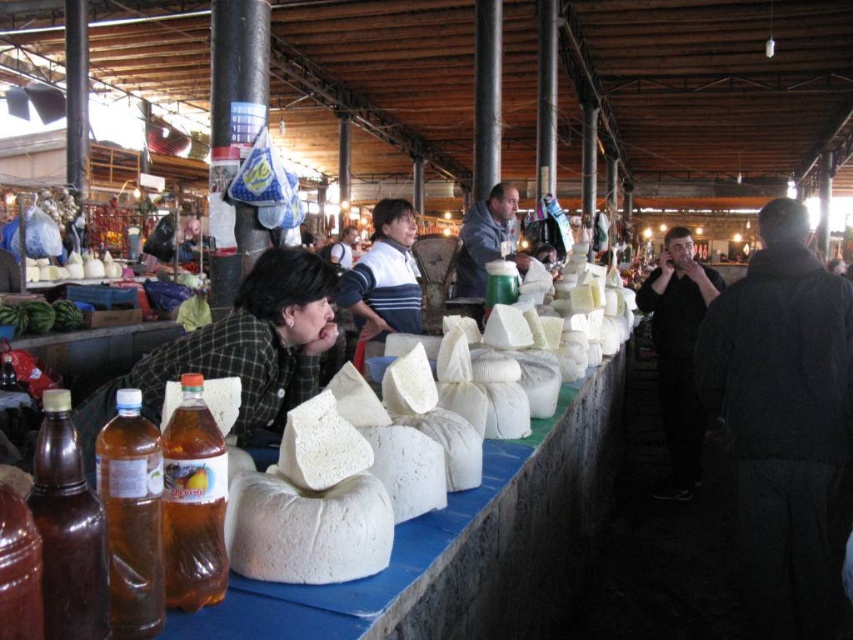
Based on the photo, you are a vendor at the cheese market and need to decide which clothing item to wear for the day. Considering the green plaid shirt at center and the gray hoodie at center, which one has a larger width?

The green plaid shirt at center has a larger width than the gray hoodie at center according to the description.

You are a customer at the cheese market and want to reach the cheese block located at point [41,492]. There is an obstacle at point [366,259]. Can you walk directly to the cheese block without going around the obstacle?

Yes, you can walk directly to the cheese block at point [41,492] because it is in front of the obstacle at point [366,259], meaning the obstacle is behind the cheese block and not in your path.

In the scene shown: You are a customer at the cheese market and want to buy a bottle of olive oil. The vendor tells you that the brown glass bottle at left and the translucent plastic bottle at lower left both contain olive oil. Which bottle should you choose if you want the larger one?

Answer: The brown glass bottle at left has a larger size compared to the translucent plastic bottle at lower left, so you should choose the brown glass bottle at left.